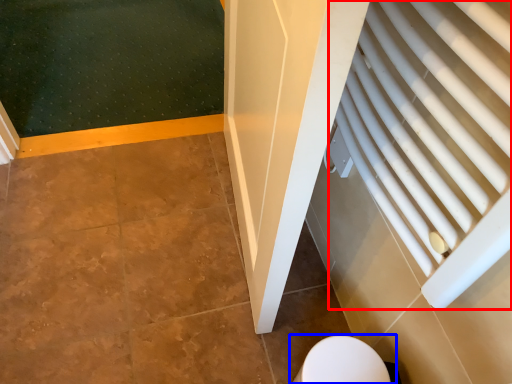
Question: Which point is further to the camera, curtain (highlighted by a red box) or toilet (highlighted by a blue box)?

Choices:
 (A) curtain
 (B) toilet

Answer: (B)